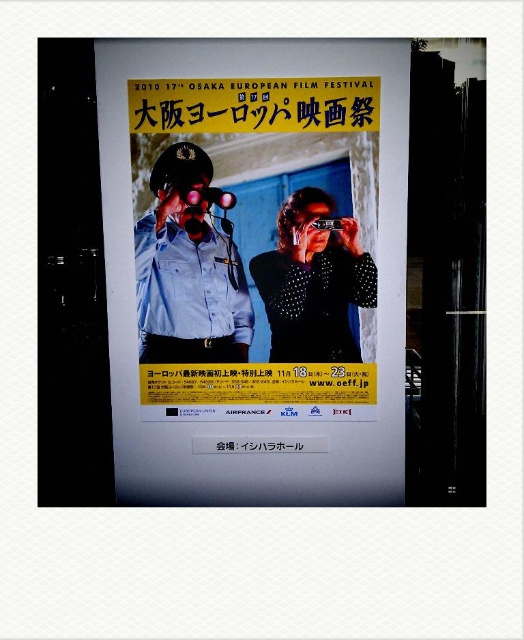
Based on the photo, who is more distant from viewer, (326, 250) or (180, 182)?

The point (326, 250) is behind.

You are a GUI agent. You are given a task and a screenshot of the screen. Output one action in this format:
    pyautogui.click(x=<x>, y=<y>)
    Task: Click on the studded leather jacket at center
    The image size is (524, 640).
    Given the screenshot: What is the action you would take?
    pyautogui.click(x=313, y=282)

Is matte blue uniform at center positioned behind matte black goggles at center?

No, it is not.

Who is higher up, matte blue uniform at center or matte black goggles at center?

matte black goggles at center is higher up.

Who is more distant from viewer, [224,360] or [198,202]?

Positioned behind is point [224,360].

At what (x,y) coordinates should I click in order to perform the action: click on matte blue uniform at center. Please return your answer as a coordinate pair (x, y). Looking at the image, I should click on (189, 273).

Who is taller, matte paper poster at center or matte black goggles at center?

matte paper poster at center is taller.

Can you confirm if matte paper poster at center is positioned to the left of matte black goggles at center?

Incorrect, matte paper poster at center is not on the left side of matte black goggles at center.

Where is `matte paper poster at center`? The height and width of the screenshot is (640, 524). matte paper poster at center is located at coordinates (257, 268).